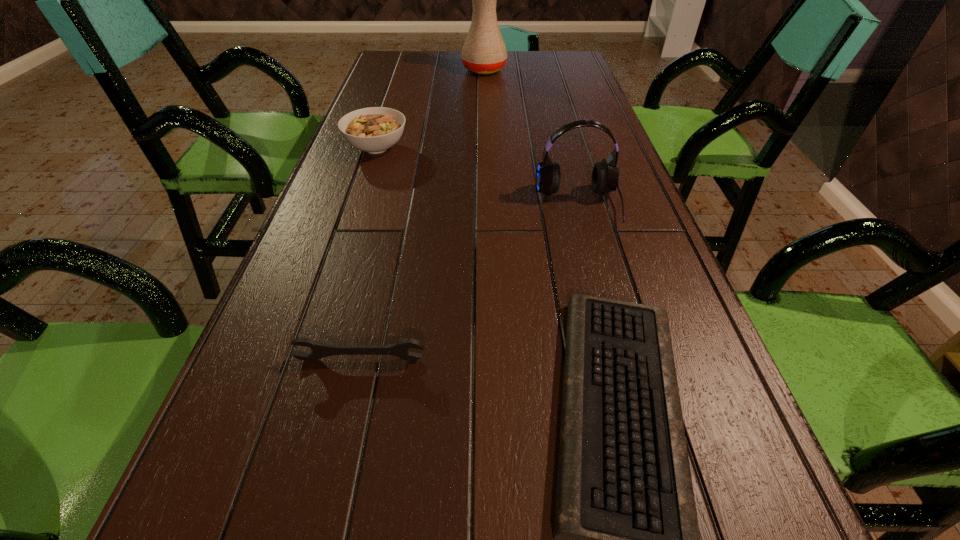
I want to click on vacant area between the second tallest object and the pottery, so click(531, 138).

This screenshot has height=540, width=960. I want to click on free space between the second farthest object and the third farthest object, so click(477, 177).

I want to click on free space between the headset and the farthest object, so click(x=531, y=138).

What are the coordinates of `free area in between the third nearest object and the wrench` in the screenshot? It's located at (469, 283).

Image resolution: width=960 pixels, height=540 pixels. Find the location of `empty location between the second shortest object and the stew`. empty location between the second shortest object and the stew is located at coordinates (369, 254).

You are a GUI agent. You are given a task and a screenshot of the screen. Output one action in this format:
    pyautogui.click(x=<x>, y=<y>)
    Task: Click on the object that is the third closest one to the stew
    The image size is (960, 540).
    Given the screenshot: What is the action you would take?
    pyautogui.click(x=626, y=538)

Identify which object is the second nearest to the farthest object. Please provide its 2D coordinates. Your answer should be formatted as a tuple, i.e. [(x, y)], where the tuple contains the x and y coordinates of a point satisfying the conditions above.

[(605, 175)]